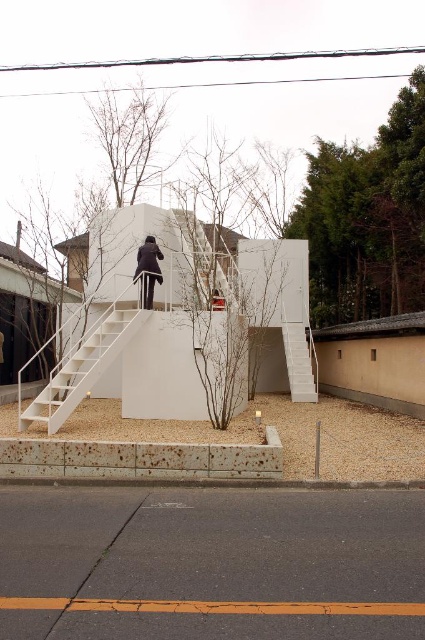
Is point (76, 404) closer to viewer compared to point (232, 248)?

Yes, point (76, 404) is closer to viewer.

Is point (118, 336) more distant than point (232, 284)?

No, it is in front of (232, 284).

The width and height of the screenshot is (425, 640). I want to click on white matte staircase at center, so click(x=82, y=365).

Based on the photo, is white matte staircase at center smaller than black matte jacket at center?

Actually, white matte staircase at center might be larger than black matte jacket at center.

Does white matte staircase at center have a larger size compared to black matte jacket at center?

Yes.

What do you see at coordinates (82, 365) in the screenshot?
I see `white matte staircase at center` at bounding box center [82, 365].

This screenshot has width=425, height=640. Identify the location of white matte staircase at center. (82, 365).

Can you confirm if white matte stair at center is thinner than black matte jacket at center?

Incorrect, white matte stair at center's width is not less than black matte jacket at center's.

Who is positioned more to the right, white matte stair at center or black matte jacket at center?

Positioned to the right is white matte stair at center.

This screenshot has width=425, height=640. Find the location of `white matte stair at center`. white matte stair at center is located at coordinates (209, 253).